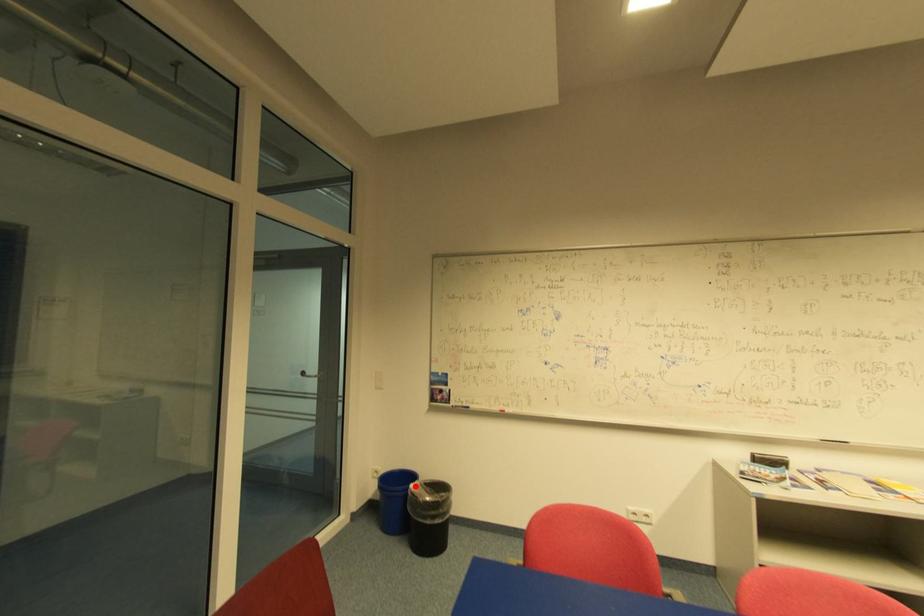
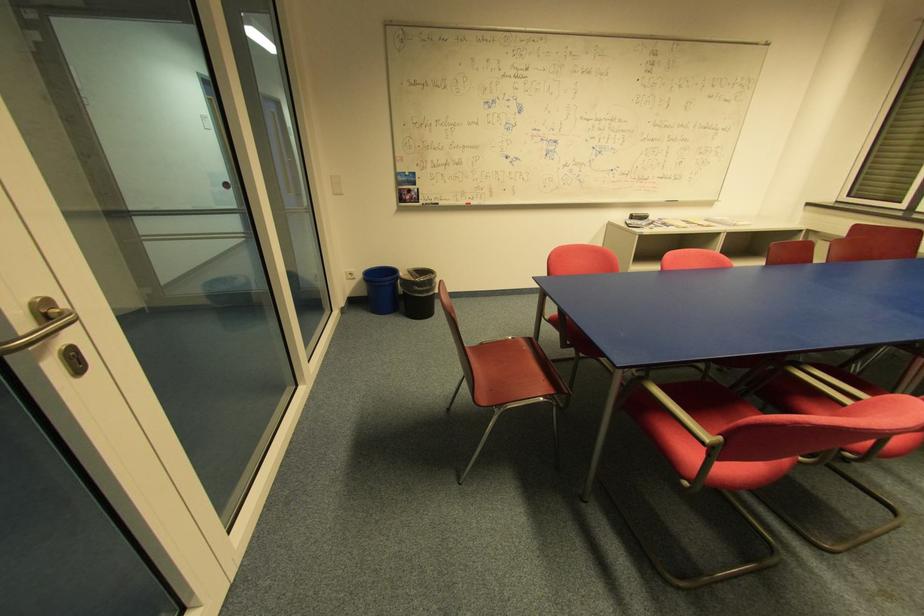
Question: I am providing you with two images of the same scene from different viewpoints. A red point is shown in image1. For the corresponding object point in image2, is it positioned nearer or farther from the camera?

Choices:
 (A) Nearer
 (B) Farther

Answer: (A)